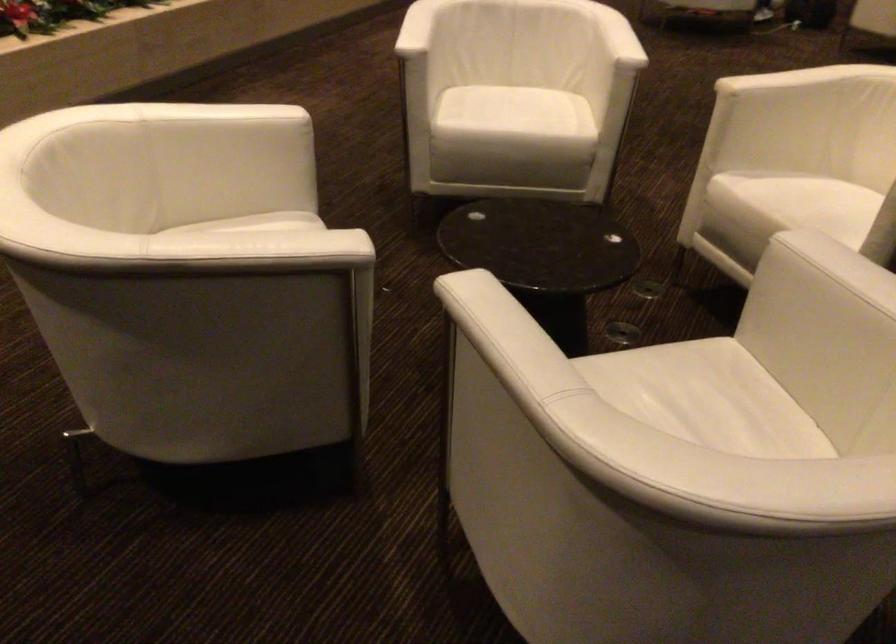
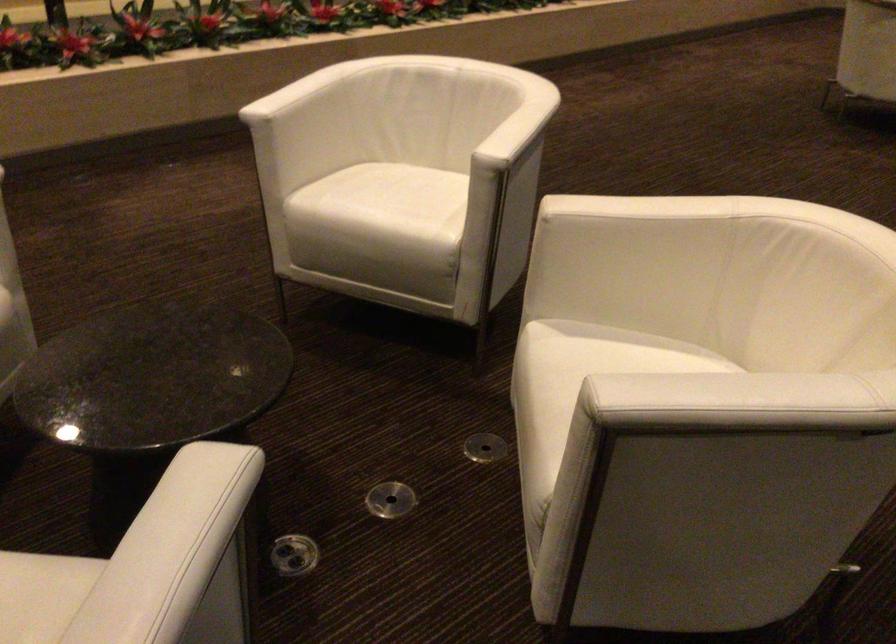
Find the pixel in the second image that matches the point at 617,337 in the first image.

(391, 500)